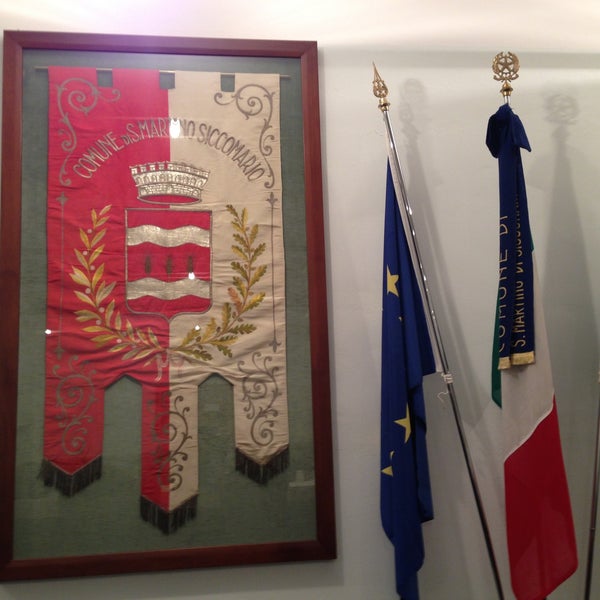
You are a GUI agent. You are given a task and a screenshot of the screen. Output one action in this format:
    pyautogui.click(x=<x>, y=<y>)
    Task: Click on the tassle
    Image resolution: width=600 pixels, height=600 pixels.
    Given the screenshot: What is the action you would take?
    pyautogui.click(x=54, y=476), pyautogui.click(x=72, y=484), pyautogui.click(x=88, y=474), pyautogui.click(x=145, y=512), pyautogui.click(x=162, y=520), pyautogui.click(x=182, y=516), pyautogui.click(x=243, y=465), pyautogui.click(x=253, y=472), pyautogui.click(x=273, y=467)